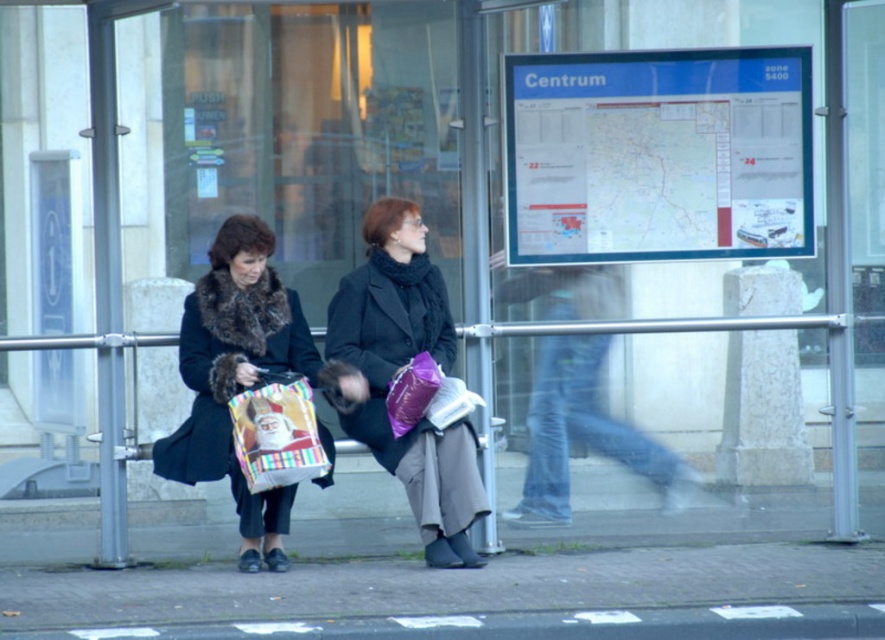
Question: Which object is farther from the camera taking this photo?

Choices:
 (A) matte plastic bag at center
 (B) purple matte bag at center
 (C) matte black coat at center

Answer: (C)

Question: Is matte black coat at center thinner than matte plastic bag at center?

Choices:
 (A) no
 (B) yes

Answer: (A)

Question: Which object is closer to the camera taking this photo?

Choices:
 (A) matte black coat at center
 (B) velvet black coat at left
 (C) purple matte bag at center

Answer: (C)

Question: Does matte black coat at center lie behind purple matte bag at center?

Choices:
 (A) yes
 (B) no

Answer: (A)

Question: Among these points, which one is nearest to the camera?

Choices:
 (A) (291, 426)
 (B) (470, 460)
 (C) (421, 352)
 (D) (214, 278)

Answer: (A)

Question: Can you confirm if matte plastic bag at center is wider than purple matte bag at center?

Choices:
 (A) no
 (B) yes

Answer: (B)